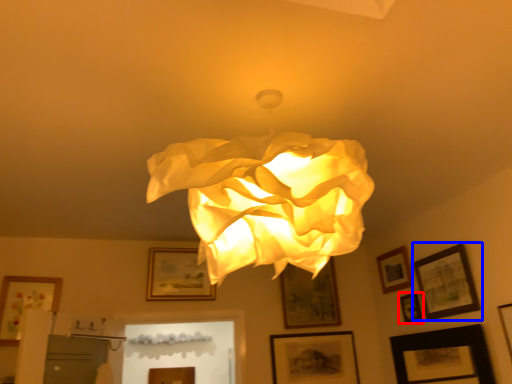
Question: Which object appears closest to the camera in this image, picture frame (highlighted by a red box) or picture frame (highlighted by a blue box)?

Choices:
 (A) picture frame
 (B) picture frame

Answer: (B)